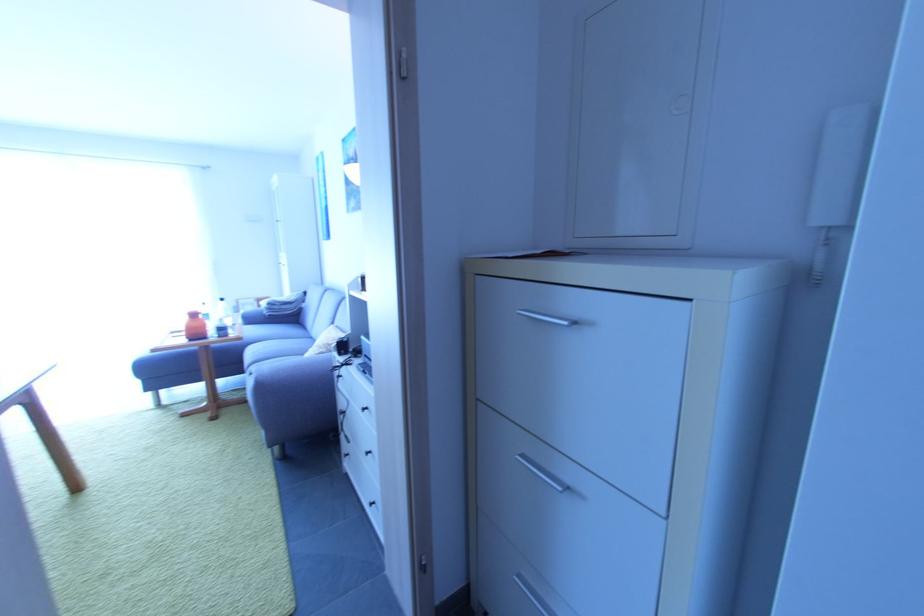
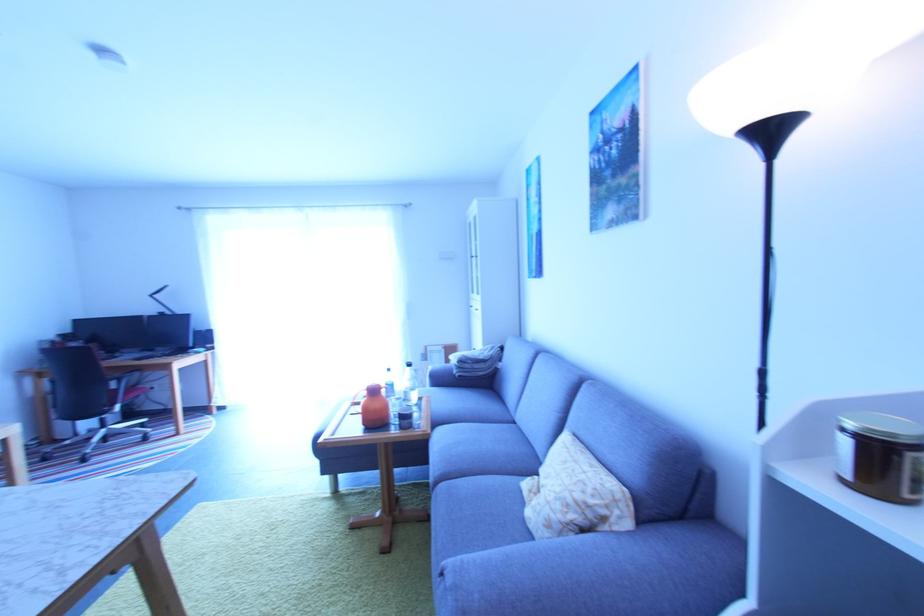
Which direction would the cameraman need to move to produce the second image?

The movement direction of the cameraman is left, forward.